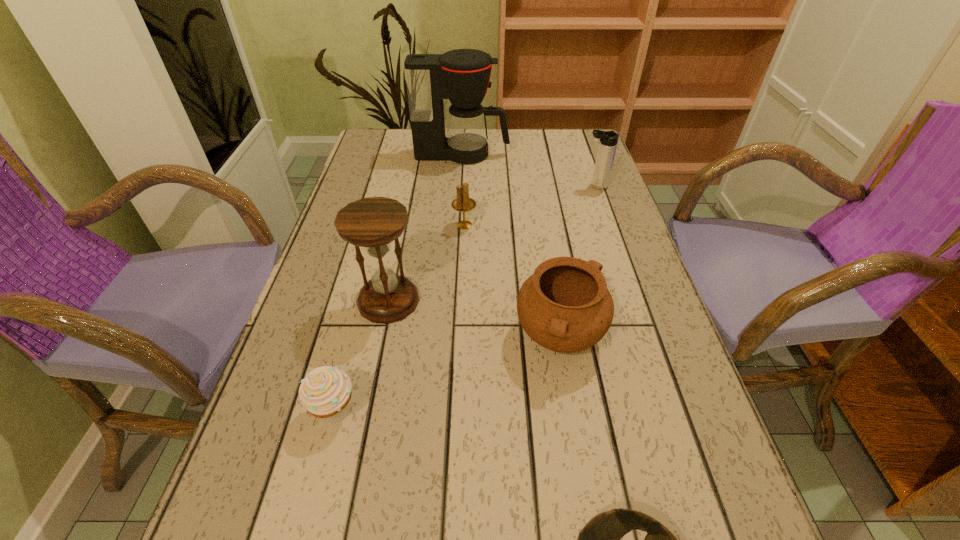
The height and width of the screenshot is (540, 960). What are the coordinates of `the farthest object` in the screenshot? It's located at (462, 75).

The width and height of the screenshot is (960, 540). In order to click on the tallest object in this screenshot , I will do `click(462, 75)`.

The height and width of the screenshot is (540, 960). I want to click on hourglass, so click(373, 223).

Find the location of a particular element. This screenshot has width=960, height=540. the rightmost object is located at coordinates (608, 140).

This screenshot has width=960, height=540. In order to click on thermos bottle in this screenshot , I will do `click(608, 140)`.

The width and height of the screenshot is (960, 540). Identify the location of pottery. (565, 306).

Locate an element on the screen. Image resolution: width=960 pixels, height=540 pixels. the fifth nearest object is located at coordinates (462, 203).

Find the location of a particular element. The image size is (960, 540). the sixth tallest object is located at coordinates (325, 392).

Find the location of a particular element. The height and width of the screenshot is (540, 960). the second nearest object is located at coordinates (325, 392).

The width and height of the screenshot is (960, 540). Find the location of `free space located 0.130m pour from the carafe of the coffee maker`. free space located 0.130m pour from the carafe of the coffee maker is located at coordinates (551, 154).